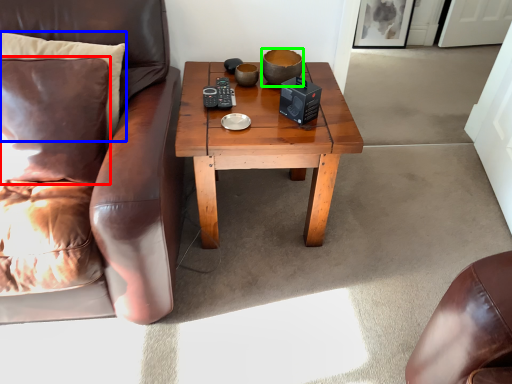
Question: Which object is the closest to the pillow (highlighted by a red box)? Choose among these: pillow (highlighted by a blue box) or bowl (highlighted by a green box).

Choices:
 (A) pillow
 (B) bowl

Answer: (A)